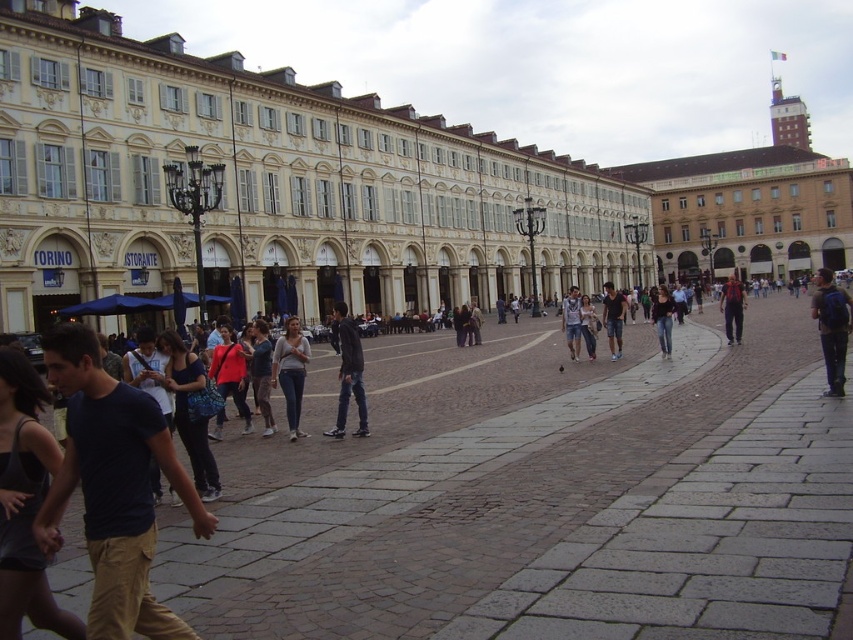
Can you confirm if white stone building at center is shorter than dark blue jeans at center?

In fact, white stone building at center may be taller than dark blue jeans at center.

Based on the photo, who is higher up, white stone building at center or dark blue jeans at center?

white stone building at center is above.

Identify the location of white stone building at center. The image size is (853, 640). (268, 188).

The image size is (853, 640). I want to click on white stone building at center, so click(x=268, y=188).

Can you confirm if dark gray leather jacket at center is wider than jeans at center?

No, dark gray leather jacket at center is not wider than jeans at center.

What do you see at coordinates (349, 374) in the screenshot? I see `dark gray leather jacket at center` at bounding box center [349, 374].

Which is in front, point (358, 435) or point (657, 324)?

Point (358, 435) is more forward.

In order to click on dark gray leather jacket at center in this screenshot , I will do `click(349, 374)`.

How far apart are dark blue backpack at right and denim shorts at center?

A distance of 85.23 feet exists between dark blue backpack at right and denim shorts at center.

Is dark blue backpack at right to the left of denim shorts at center from the viewer's perspective?

Incorrect, dark blue backpack at right is not on the left side of denim shorts at center.

Does point (822, 292) lie in front of point (577, 292)?

Yes, it is in front of point (577, 292).

Locate an element on the screen. dark blue backpack at right is located at coordinates (833, 326).